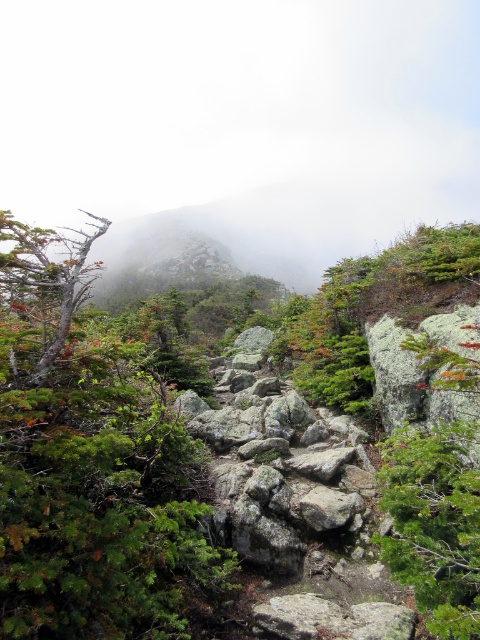
You are a hiker carrying a backpack and need to cross a rocky trail. There are two points marked on the trail. The first point is at coordinate point (48, 349). The second point is at coordinate point 0.650, 0.150. Can you safely walk from the first point to the second point without needing to jump?

The two points are 4.23 meters apart, so you can safely walk from the first point to the second point without needing to jump since the distance is manageable for walking.

You are a hiker trying to navigate through the rocky trail. You notice two trees on your left side, the green matte tree at left and the smooth gray tree at left. Which tree takes up more space in the scene?

The smooth gray tree at left occupies more space than the green matte tree at left.

You are a hiker planning to set up a tent in this mountainous area. You notice the green matte tree at left and the smooth gray tree at left. Which tree is shorter and would be a better option to place your tent closer to for shelter from the wind?

The green matte tree at left is shorter than the smooth gray tree at left, so placing the tent closer to the green matte tree at left would provide better shelter from the wind due to its lower height.